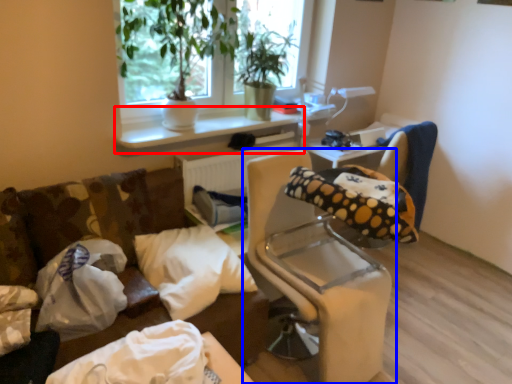
Question: Which object appears farthest to the camera in this image, window sill (highlighted by a red box) or furniture (highlighted by a blue box)?

Choices:
 (A) window sill
 (B) furniture

Answer: (A)